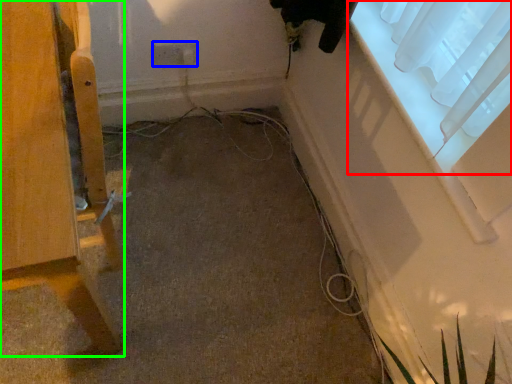
Question: Which is nearer to the window (highlighted by a red box)? electric outlet (highlighted by a blue box) or furniture (highlighted by a green box).

Choices:
 (A) electric outlet
 (B) furniture

Answer: (A)